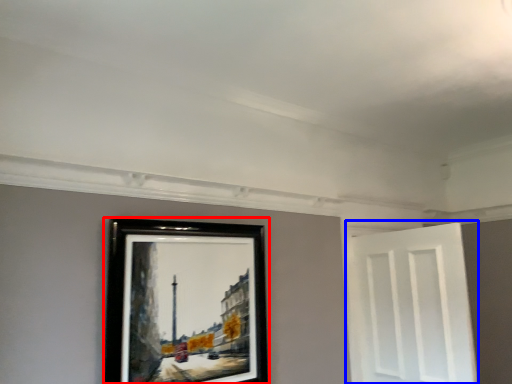
Question: Which of the following is the farthest to the observer, picture frame (highlighted by a red box) or door (highlighted by a blue box)?

Choices:
 (A) picture frame
 (B) door

Answer: (B)